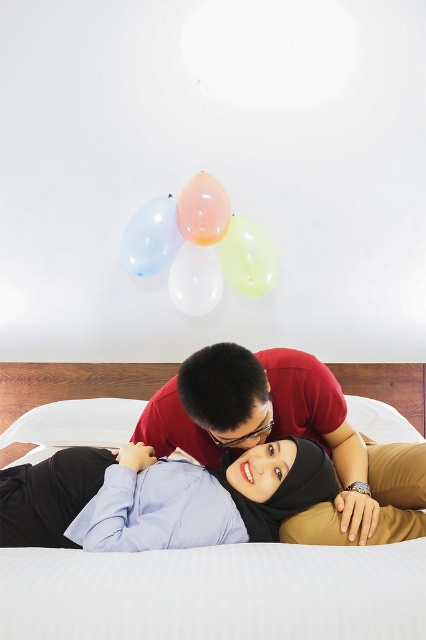
Question: Which is nearer to the translucent yellow balloon at upper center?

Choices:
 (A) white soft bed at center
 (B) white soft pillow at center
 (C) matte blue shirt at center

Answer: (B)

Question: Can you confirm if matte red shirt at center is positioned to the right of translucent white balloon at upper center?

Choices:
 (A) yes
 (B) no

Answer: (A)

Question: Is the position of white soft bed at center less distant than that of translucent blue balloon at upper center?

Choices:
 (A) no
 (B) yes

Answer: (B)

Question: Which is nearer to the translucent yellow balloon at upper center?

Choices:
 (A) translucent blue balloon at upper center
 (B) matte red shirt at center
 (C) white soft bed at center
 (D) white soft pillow at center

Answer: (A)

Question: Which point is farther to the camera?

Choices:
 (A) (123, 241)
 (B) (207, 182)
 (C) (172, 292)

Answer: (C)

Question: Does white soft bed at center have a smaller size compared to matte red shirt at center?

Choices:
 (A) no
 (B) yes

Answer: (B)